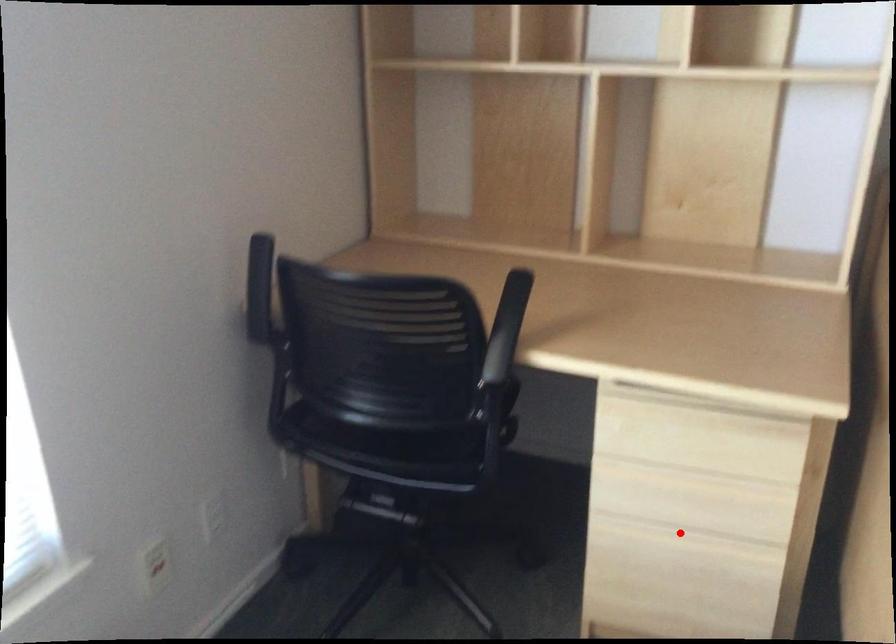
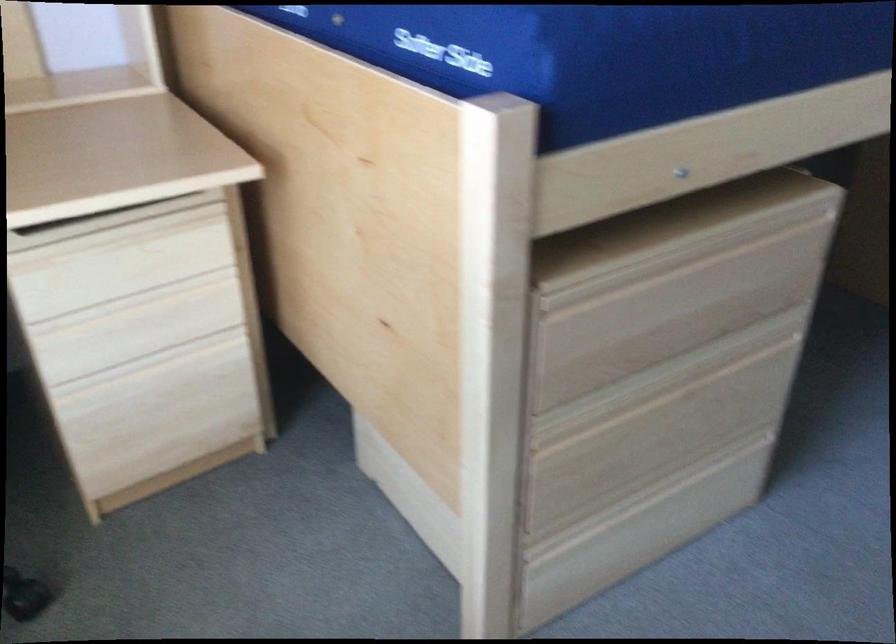
In the second image, find the point that corresponds to the highlighted location in the first image.

(152, 361)